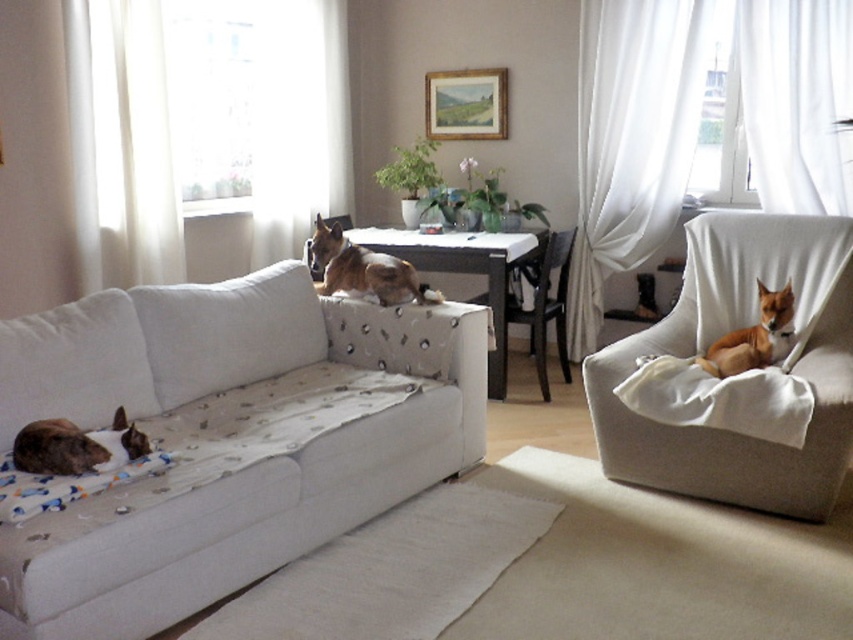
Is white fabric pillow at center closer to the viewer compared to fluffy brown cat at lower left?

No, white fabric pillow at center is behind fluffy brown cat at lower left.

This screenshot has width=853, height=640. In order to click on white fabric pillow at center in this screenshot , I will do `click(228, 330)`.

What are the coordinates of `white fabric pillow at center` in the screenshot? It's located at point(228,330).

Between fluffy brown cat at lower left and brown furry dog at right, which one appears on the right side from the viewer's perspective?

brown furry dog at right is more to the right.

What do you see at coordinates (76, 445) in the screenshot? I see `fluffy brown cat at lower left` at bounding box center [76, 445].

You are a GUI agent. You are given a task and a screenshot of the screen. Output one action in this format:
    pyautogui.click(x=<x>, y=<y>)
    Task: Click on the fluffy brown cat at lower left
    This screenshot has height=640, width=853.
    Given the screenshot: What is the action you would take?
    pyautogui.click(x=76, y=445)

Looking at this image, does white sheer curtain at upper right have a lesser height compared to brown furry dog at right?

In fact, white sheer curtain at upper right may be taller than brown furry dog at right.

Can you confirm if white sheer curtain at upper right is thinner than brown furry dog at right?

No, white sheer curtain at upper right is not thinner than brown furry dog at right.

From the picture: Who is more forward, (599, 308) or (724, 355)?

Point (724, 355) is more forward.

Identify the location of white sheer curtain at upper right. This screenshot has height=640, width=853. (631, 138).